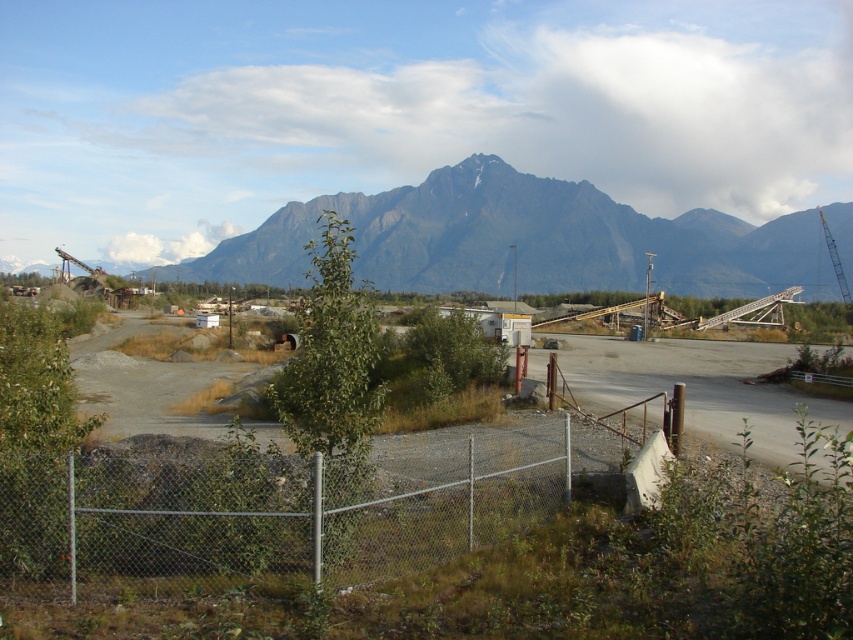
Question: Which point is closer to the camera taking this photo?

Choices:
 (A) (30, 596)
 (B) (438, 545)

Answer: (A)

Question: Is metallic gravel at center smaller than metal chain-link fence at lower center?

Choices:
 (A) no
 (B) yes

Answer: (A)

Question: Is metallic gravel at center wider than metal chain-link fence at lower center?

Choices:
 (A) yes
 (B) no

Answer: (A)

Question: Which of the following is the closest to the observer?

Choices:
 (A) metallic gravel at center
 (B) metal chain-link fence at lower center

Answer: (A)

Question: Considering the relative positions of metallic gravel at center and metal chain-link fence at lower center in the image provided, where is metallic gravel at center located with respect to metal chain-link fence at lower center?

Choices:
 (A) above
 (B) below

Answer: (B)